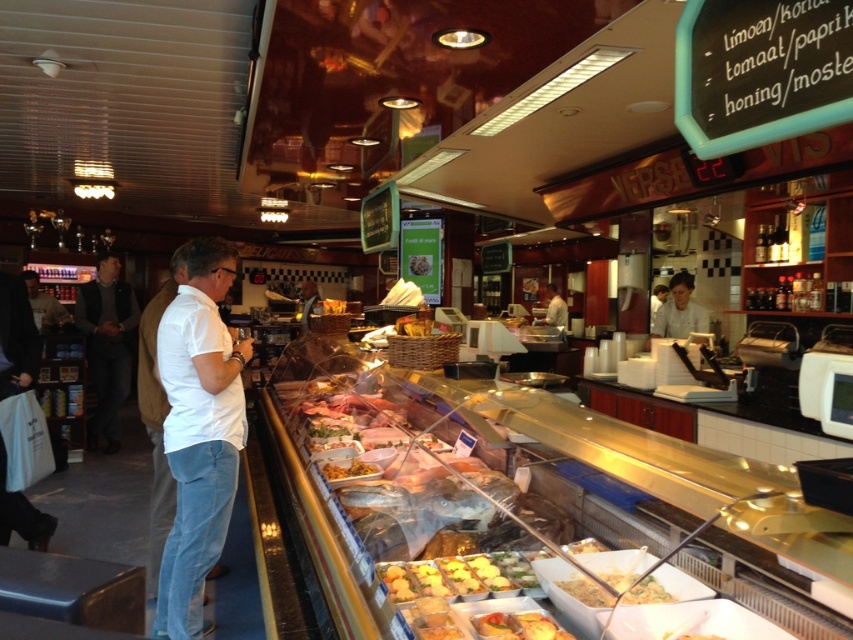
Question: Considering the relative positions of dark gray sweater at left and white shirt at center in the image provided, where is dark gray sweater at left located with respect to white shirt at center?

Choices:
 (A) right
 (B) left

Answer: (B)

Question: Which of the following is the farthest from the observer?

Choices:
 (A) dark gray sweater at left
 (B) golden crispy fries at center
 (C) white uniform at upper right
 (D) yellow creamy soup at center

Answer: (A)

Question: Does yellow creamy soup at center come in front of white uniform at upper right?

Choices:
 (A) no
 (B) yes

Answer: (B)

Question: Estimate the real-world distances between objects in this image. Which object is farther from the white shirt at center?

Choices:
 (A) yellow creamy soup at center
 (B) dark gray sweater at left
 (C) white uniform at upper right
 (D) golden brown bread at center

Answer: (A)

Question: Is white uniform at upper right closer to the viewer compared to golden brown bread at center?

Choices:
 (A) yes
 (B) no

Answer: (B)

Question: Which object is the closest to the white uniform at upper right?

Choices:
 (A) golden brown bread at center
 (B) golden crispy fries at center

Answer: (A)